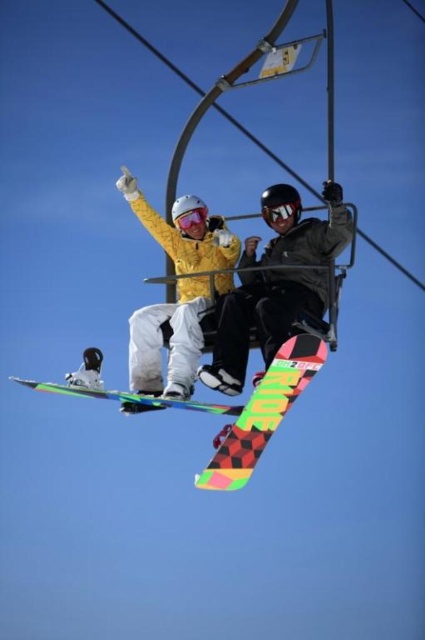
You are a ski lift attendant and need to ensure that the snowboards of the passengers are arranged properly. According to the image, which snowboard is positioned to the right side of the other between the matte black snowboard at center and the matte yellow snowboard at center?

The matte black snowboard at center is positioned to the right of the matte yellow snowboard at center.

You are a ski lift operator checking the width of the snowboards to ensure they fit within the lift. The maximum allowable width is 25 cm. You observe the matte black snowboard at center and the multicolored checkered snowboard at center. Which snowboard is more likely to exceed the width limit?

The matte black snowboard at center might be wider than the multicolored checkered snowboard at center, so it is more likely to exceed the 25 cm width limit.